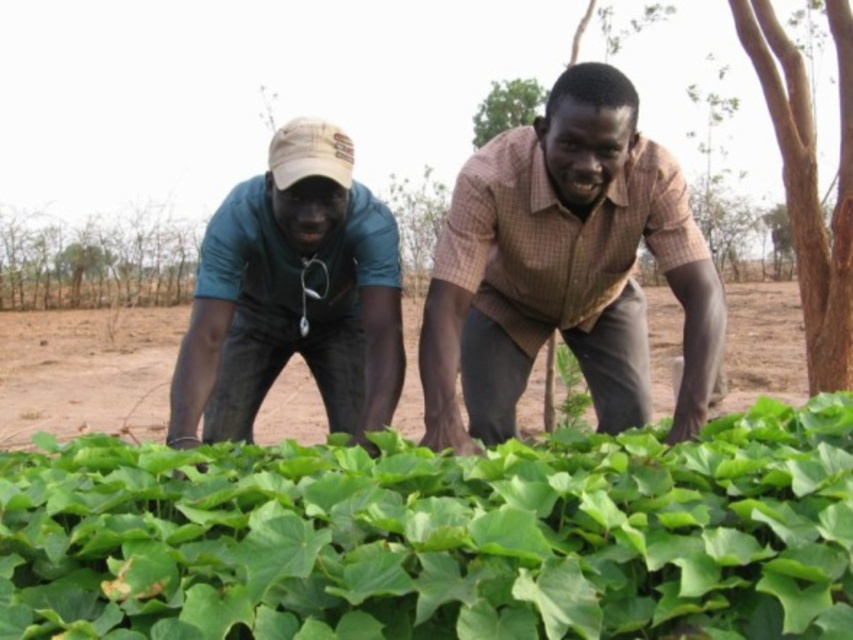
Question: In this image, where is brown checkered shirt at center located relative to matte green shirt at left?

Choices:
 (A) below
 (B) above

Answer: (B)

Question: Which of these objects is positioned farthest from the green leafy plant at lower center?

Choices:
 (A) brown checkered shirt at center
 (B) matte green shirt at left

Answer: (B)

Question: Does green leafy plant at lower center appear on the left side of brown checkered shirt at center?

Choices:
 (A) yes
 (B) no

Answer: (A)

Question: Estimate the real-world distances between objects in this image. Which object is farther from the matte green shirt at left?

Choices:
 (A) brown checkered shirt at center
 (B) green leafy plant at lower center

Answer: (B)

Question: Which object is the farthest from the matte green shirt at left?

Choices:
 (A) green leafy plant at lower center
 (B) brown checkered shirt at center

Answer: (A)

Question: Is brown checkered shirt at center closer to camera compared to matte green shirt at left?

Choices:
 (A) no
 (B) yes

Answer: (B)